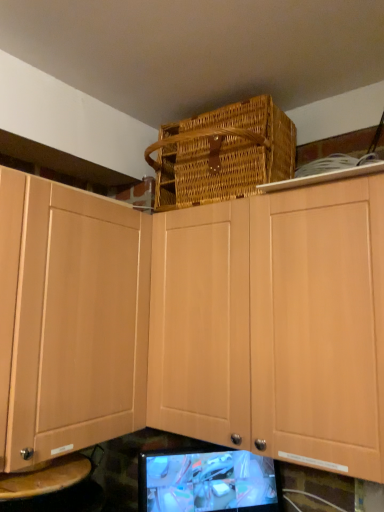
Question: Considering the positions of point (354, 374) and point (274, 483), is point (354, 374) closer or farther from the camera than point (274, 483)?

Choices:
 (A) closer
 (B) farther

Answer: (A)

Question: Would you say light wood cabinet at upper center is to the left or to the right of matte black monitor at lower center in the picture?

Choices:
 (A) left
 (B) right

Answer: (B)

Question: Estimate the real-world distances between objects in this image. Which object is closer to the light wood cabinet at upper center?

Choices:
 (A) woven brown basket at upper center
 (B) matte black monitor at lower center

Answer: (A)

Question: Which object is the closest to the matte black monitor at lower center?

Choices:
 (A) woven brown basket at upper center
 (B) light wood cabinet at upper center

Answer: (B)